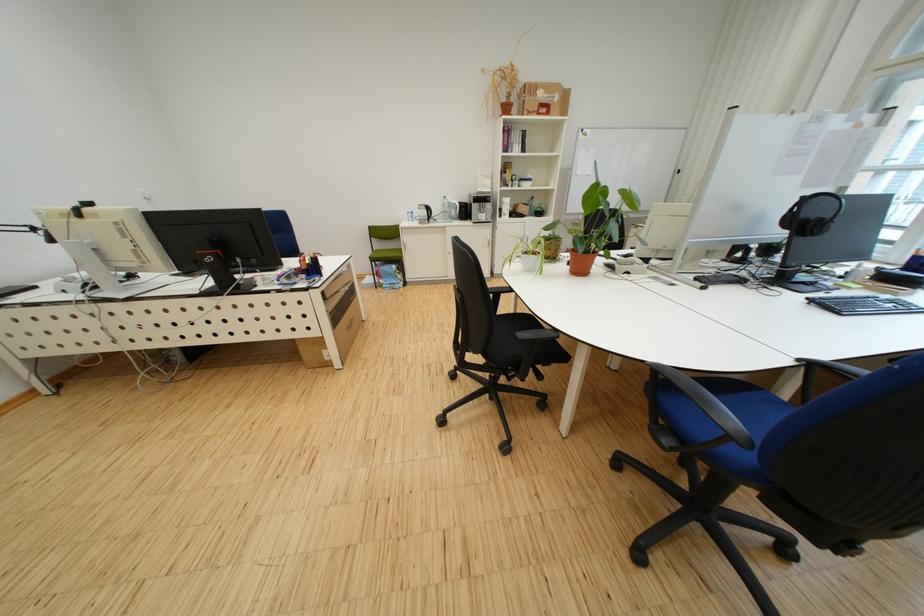
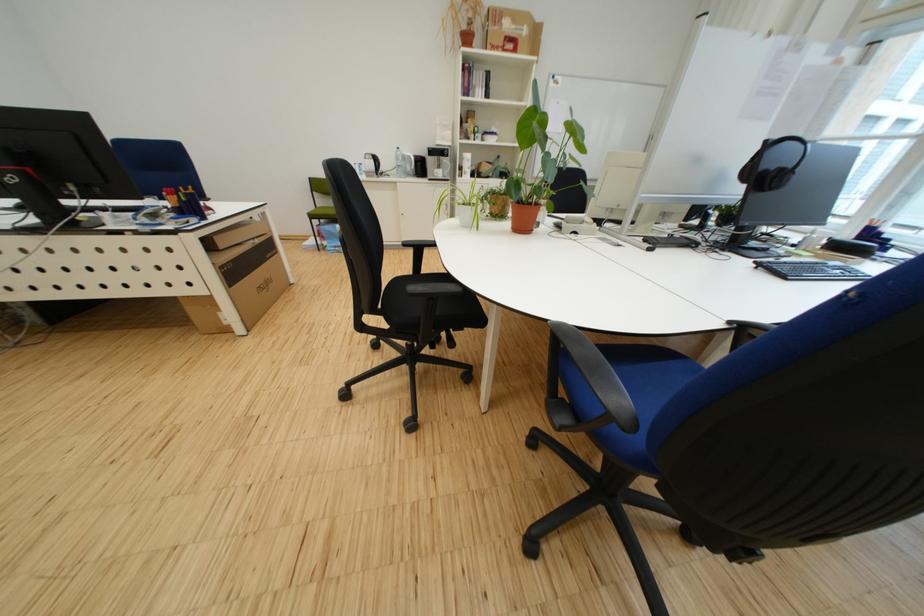
Locate, in the second image, the point that corresponds to the point at 565,260 in the first image.

(509, 217)